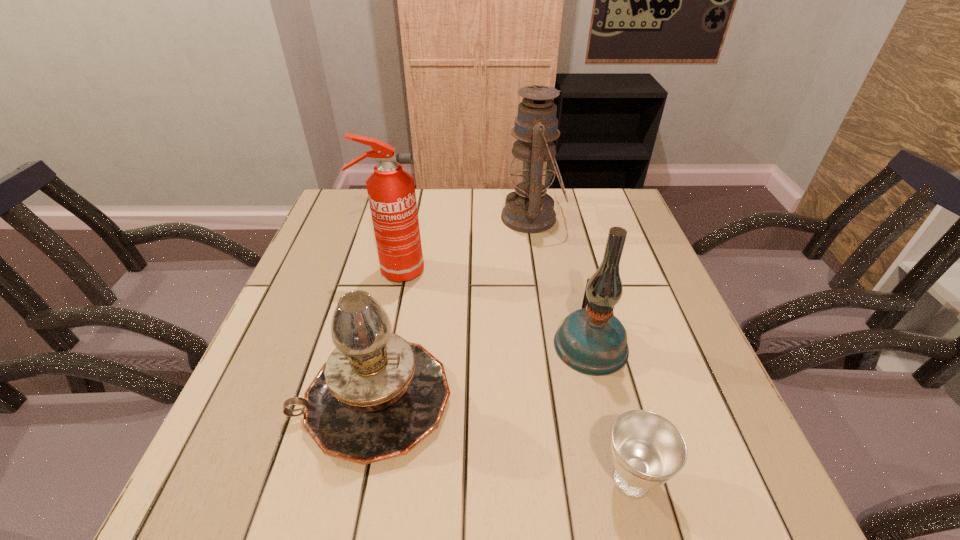
At what (x,y) coordinates should I click in order to perform the action: click on free space at the left edge of the desktop. Please return your answer as a coordinate pair (x, y). This screenshot has width=960, height=540. Looking at the image, I should click on (323, 235).

Identify the location of blank area at the right edge. (712, 404).

I want to click on vacant space at the far left corner, so click(x=352, y=221).

Locate an element on the screen. This screenshot has height=540, width=960. vacant space at the near left corner of the desktop is located at coordinates (231, 482).

In the image, there is a desktop. Identify the location of free space at the far right corner. Image resolution: width=960 pixels, height=540 pixels. (621, 210).

Find the location of a particular element. The height and width of the screenshot is (540, 960). free space at the near right corner of the desktop is located at coordinates (685, 474).

Identify the location of blank region between the farthest object and the fourth nearest object. The width and height of the screenshot is (960, 540). (463, 245).

Identify the location of vacant space that is in between the tallest oil lamp and the fire extinguisher. (463, 245).

Where is `free area in between the leftmost oil lamp and the shortest object`? The image size is (960, 540). free area in between the leftmost oil lamp and the shortest object is located at coordinates (502, 440).

I want to click on free space that is in between the tallest oil lamp and the fourth nearest object, so click(x=463, y=245).